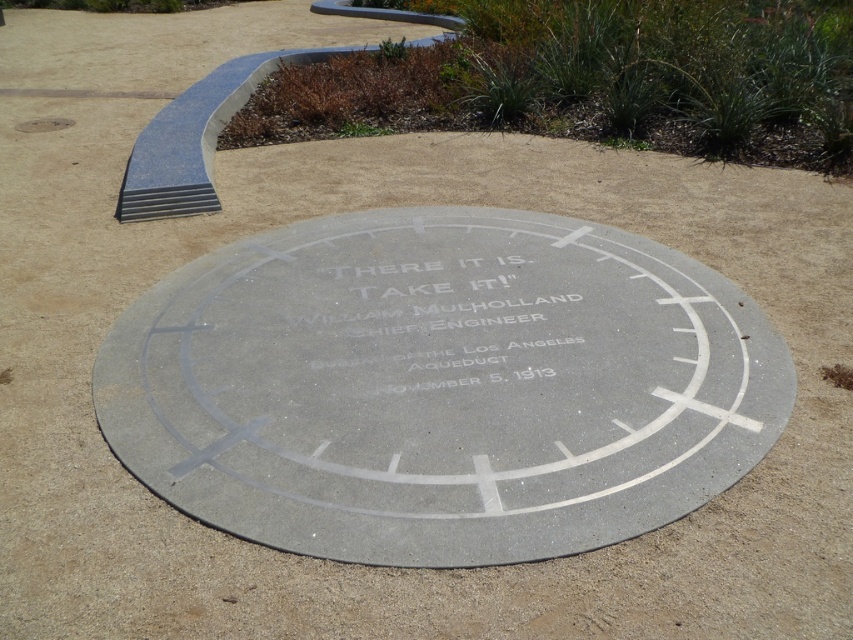
You are a construction worker inspecting the site and need to locate the gray concrete circle at center. Based on the image, where would you find it relative to the gray concrete manhole cover at upper left?

The gray concrete circle at center is positioned on the right side of the gray concrete manhole cover at upper left.

You are a city inspector checking the infrastructure. You notice the gray concrete circle at center and the gray concrete manhole cover at upper left. Which one do you think is bigger in size?

The gray concrete circle at center has a larger size compared to the gray concrete manhole cover at upper left, so the gray concrete circle at center is bigger.

You are standing at the marker and want to place a small flag at the point that is closer to the camera. Which point should you choose between point (498,289) and point (33,131)?

You should choose point (498,289) because it is closer to the camera than point (33,131).